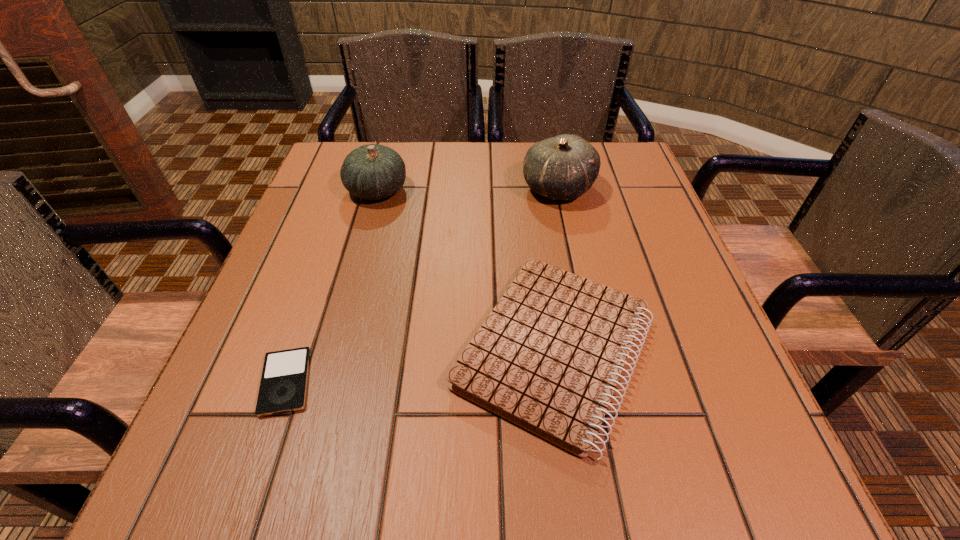
The width and height of the screenshot is (960, 540). What are the coordinates of `the right gourd` in the screenshot? It's located at (564, 167).

Where is `the left gourd`? The image size is (960, 540). the left gourd is located at coordinates (372, 172).

Identify the location of notebook. The image size is (960, 540). (548, 358).

Identify the location of the shortest object. Image resolution: width=960 pixels, height=540 pixels. (283, 386).

Where is `free space located on the left of the right gourd`? This screenshot has height=540, width=960. free space located on the left of the right gourd is located at coordinates (497, 189).

At what (x,y) coordinates should I click in order to perform the action: click on free space located on the front of the left gourd. Please return your answer as a coordinate pair (x, y). The height and width of the screenshot is (540, 960). Looking at the image, I should click on (342, 318).

Find the location of a particular element. The height and width of the screenshot is (540, 960). vacant area situated on the left of the notebook is located at coordinates (244, 349).

Where is `vacant area situated 0.070m on the back of the shortest object`? vacant area situated 0.070m on the back of the shortest object is located at coordinates (308, 318).

The image size is (960, 540). I want to click on object at the near edge, so click(x=548, y=358).

Find the location of a particular element. The height and width of the screenshot is (540, 960). gourd that is at the left edge is located at coordinates (372, 172).